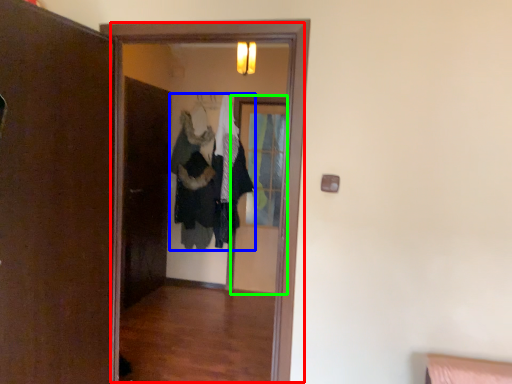
Question: Which object is positioned farthest from screen door (highlighted by a red box)? Select from clothing (highlighted by a blue box) and screen door (highlighted by a green box).

Choices:
 (A) clothing
 (B) screen door

Answer: (B)